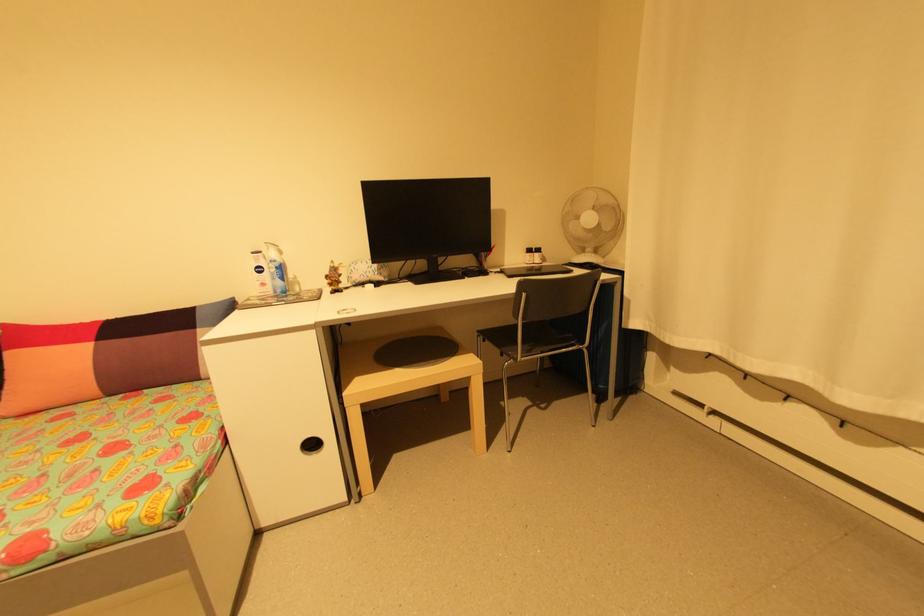
This screenshot has width=924, height=616. I want to click on blue pump dispenser, so click(275, 268).